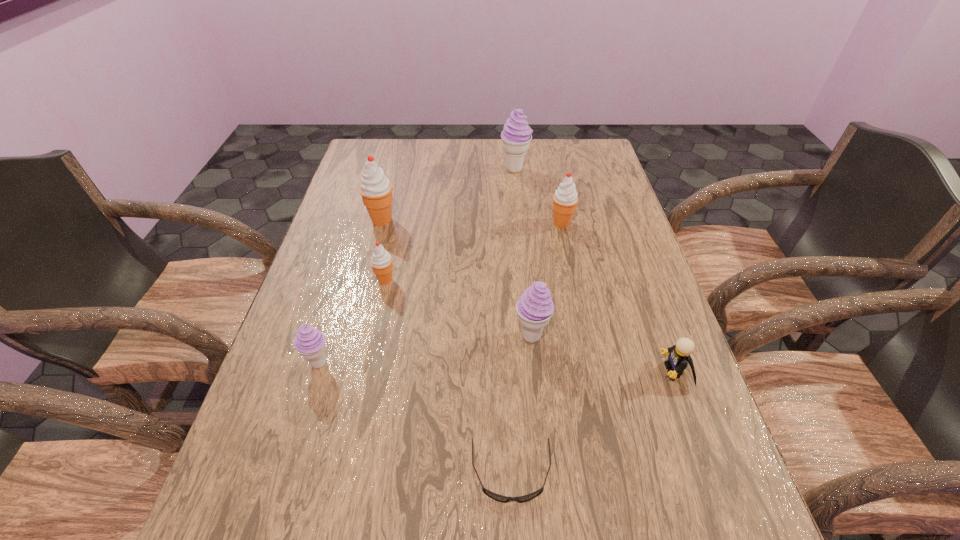
You are a GUI agent. You are given a task and a screenshot of the screen. Output one action in this format:
    pyautogui.click(x=<x>, y=<y>)
    Task: Click on the third closest purple icecream relative to the biggest red icecream
    
    Given the screenshot: What is the action you would take?
    pyautogui.click(x=535, y=307)

At what (x,y) coordinates should I click in order to perform the action: click on red icecream object that ranks as the closest to the biggest red icecream. Please return your answer as a coordinate pair (x, y). The image size is (960, 540). Looking at the image, I should click on (381, 261).

Find the location of a particular element. red icecream that is the second closest to the smallest purple icecream is located at coordinates (376, 190).

In order to click on vacant space that satisfies the following two spatial constraints: 1. on the front-facing side of the second shortest object; 2. on the front-facing side of the sunglasses in this screenshot , I will do click(712, 472).

At what (x,y) coordinates should I click in order to perform the action: click on vacant space that satisfies the following two spatial constraints: 1. on the back side of the biggest purple icecream; 2. on the right side of the nearest icecream. Please return your answer as a coordinate pair (x, y). This screenshot has height=540, width=960. Looking at the image, I should click on (378, 169).

Find the location of a particular element. The width and height of the screenshot is (960, 540). vacant space that satisfies the following two spatial constraints: 1. on the back side of the fourth nearest object; 2. on the left side of the second object from right to left is located at coordinates (519, 223).